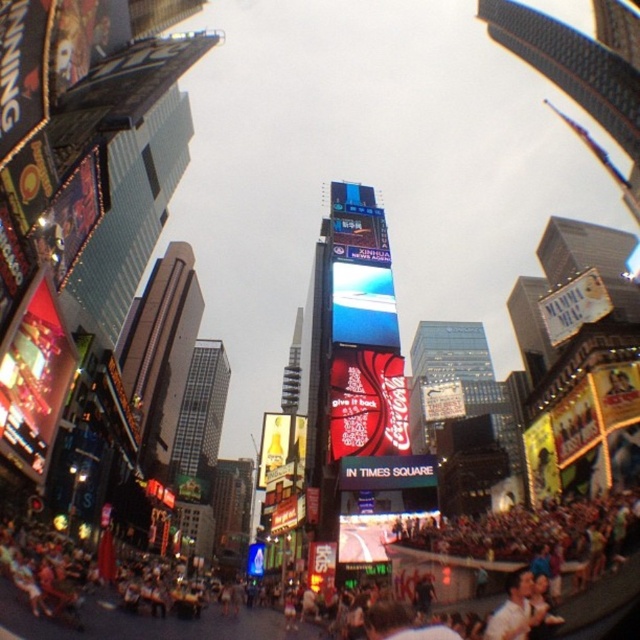
Question: Does human skin textured crowd at lower center lie in front of light brown hair at lower right?

Choices:
 (A) no
 (B) yes

Answer: (B)

Question: Does human skin textured crowd at lower center have a larger size compared to light brown hair at lower right?

Choices:
 (A) yes
 (B) no

Answer: (A)

Question: Which object is farther from the camera taking this photo?

Choices:
 (A) light brown hair at lower right
 (B) human skin textured crowd at lower center

Answer: (A)

Question: Is human skin textured crowd at lower center below light brown hair at lower right?

Choices:
 (A) yes
 (B) no

Answer: (A)